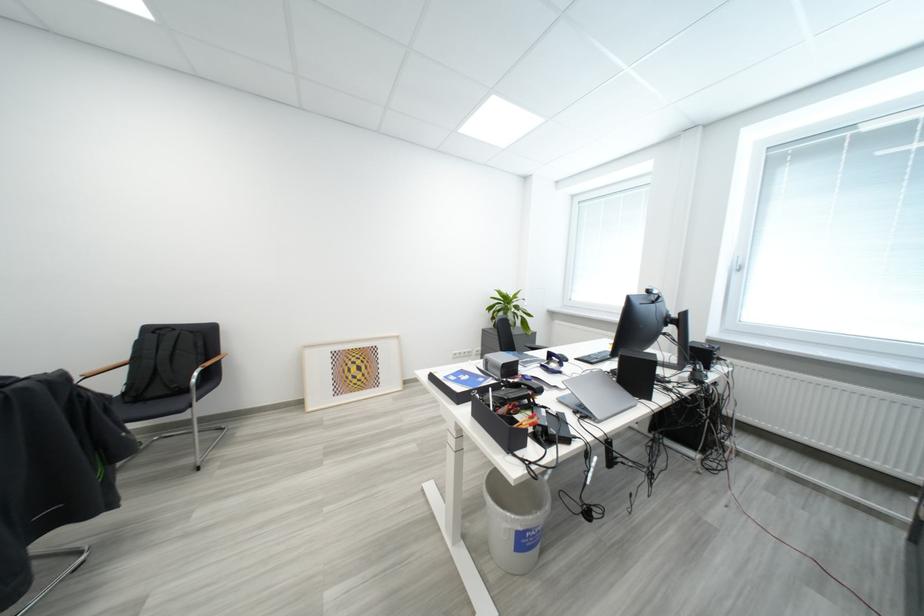
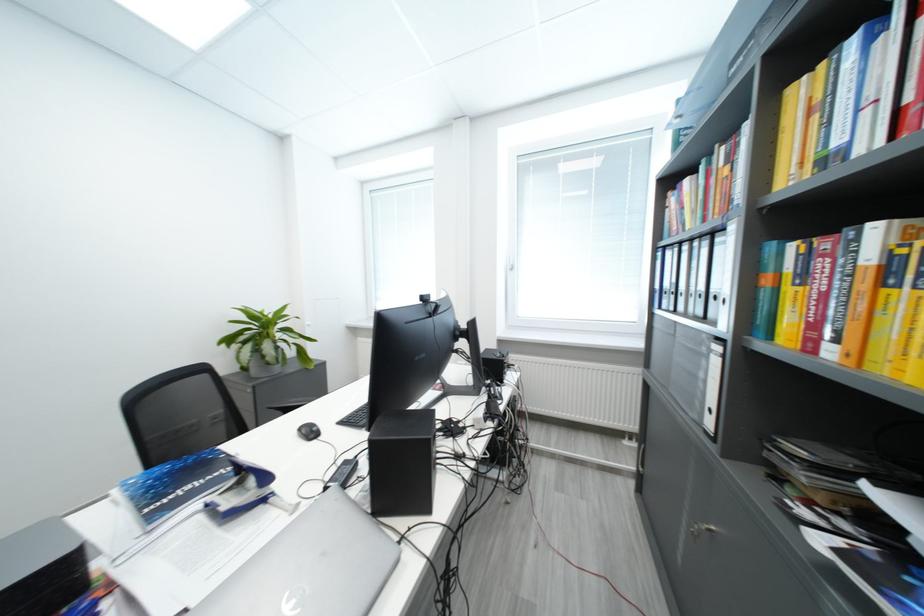
Question: Based on the continuous images, in which direction is the camera rotating? Reply with the corresponding letter.

Choices:
 (A) Left
 (B) Right
 (C) Up
 (D) Down

Answer: (B)